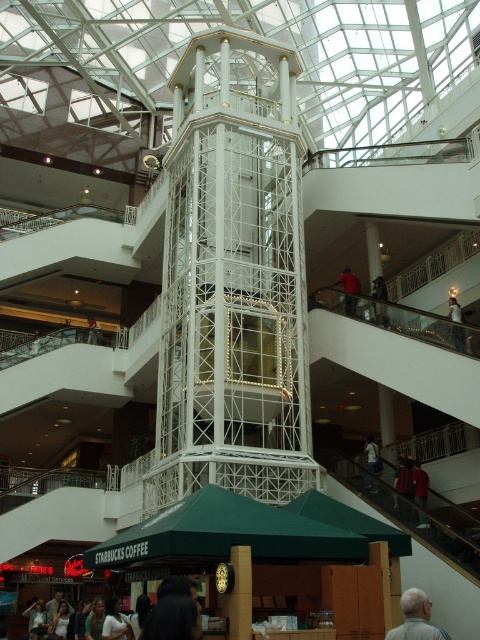
Question: Considering the real-world distances, which object is farthest from the green fabric canopy at center?

Choices:
 (A) green fabric canopy at lower center
 (B) denim jacket at lower right
 (C) white metallic bell tower at center

Answer: (C)

Question: Does dark blue jeans at center appear on the left side of denim jacket at lower right?

Choices:
 (A) no
 (B) yes

Answer: (A)

Question: Can you confirm if gray hair at lower right is wider than denim jacket at lower right?

Choices:
 (A) no
 (B) yes

Answer: (B)

Question: Which of the following is the closest to the observer?

Choices:
 (A) (419, 476)
 (B) (249, 552)
 (C) (312, 515)
 (D) (96, 339)

Answer: (B)

Question: Does red fabric at upper center appear on the right side of dark blue jeans at upper center?

Choices:
 (A) yes
 (B) no

Answer: (A)

Question: Which object is the closest to the dark blue jeans at upper center?

Choices:
 (A) white metallic pillar at center
 (B) dark blue jeans at center
 (C) red fabric at upper center
 (D) gray hair at lower right

Answer: (C)